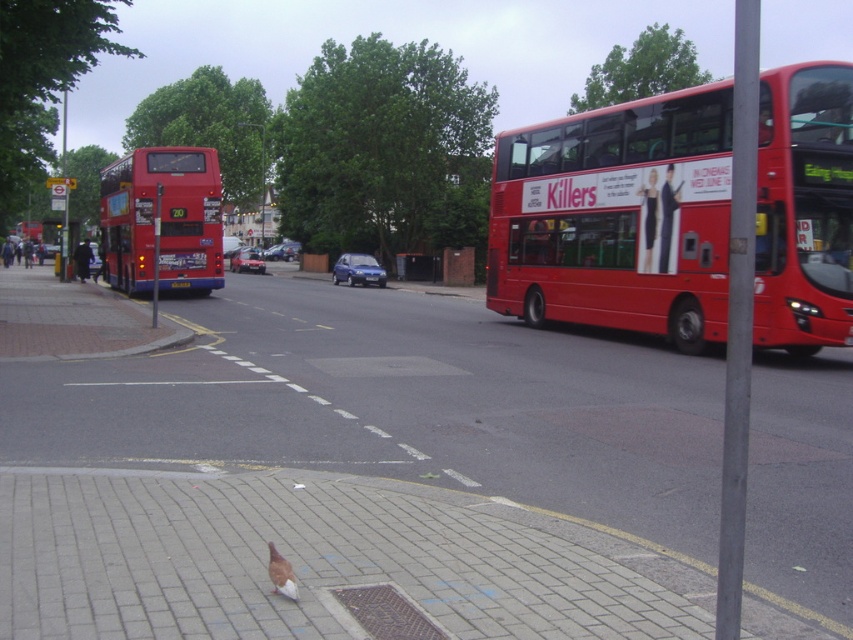
Which is behind, point (724, 99) or point (270, 554)?

The point (724, 99) is behind.

Can you confirm if red matte bus at right is positioned above brown feathered pigeon at lower center?

Yes, red matte bus at right is above brown feathered pigeon at lower center.

Between point (550, 189) and point (283, 573), which one is positioned in front?

Point (283, 573)

At what (x,y) coordinates should I click in order to perform the action: click on red matte bus at right. Please return your answer as a coordinate pair (x, y). Image resolution: width=853 pixels, height=640 pixels. Looking at the image, I should click on (618, 218).

In the scene shown: Does red matte bus at right have a smaller size compared to matte red bus at left?

Yes, red matte bus at right is smaller than matte red bus at left.

Looking at this image, does red matte bus at right have a lesser height compared to matte red bus at left?

Correct, red matte bus at right is not as tall as matte red bus at left.

Who is more forward, (837, 259) or (195, 218)?

Point (837, 259) is in front.

Find the location of `red matte bus at right`. red matte bus at right is located at coordinates 618,218.

Can you confirm if matte red bus at left is positioned to the right of brown feathered pigeon at lower center?

In fact, matte red bus at left is to the left of brown feathered pigeon at lower center.

Is point (115, 228) behind point (294, 586)?

Yes, point (115, 228) is behind point (294, 586).

Where is `matte red bus at left`? The height and width of the screenshot is (640, 853). matte red bus at left is located at coordinates (161, 220).